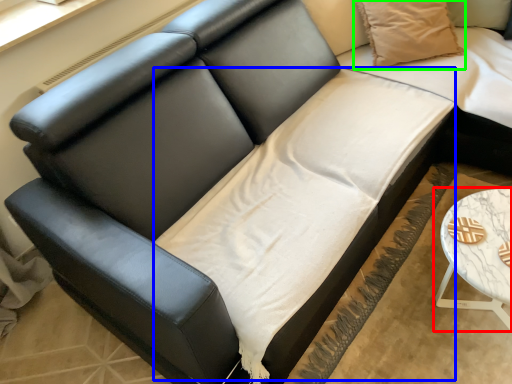
Question: Based on their relative distances, which object is nearer to table (highlighted by a red box)? Choose from sheet (highlighted by a blue box) and pillow (highlighted by a green box).

Choices:
 (A) sheet
 (B) pillow

Answer: (A)